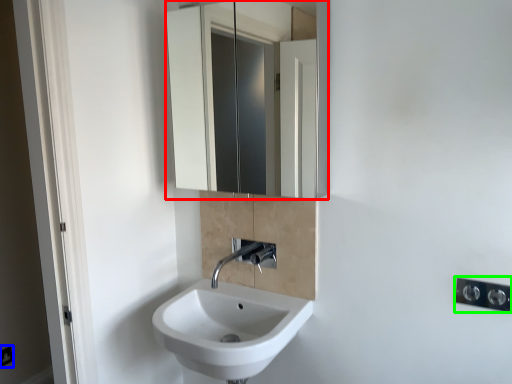
Question: Estimate the real-world distances between objects in this image. Which object is farther from mirror (highlighted by a red box), electric outlet (highlighted by a blue box) or light switch (highlighted by a green box)?

Choices:
 (A) electric outlet
 (B) light switch

Answer: (B)